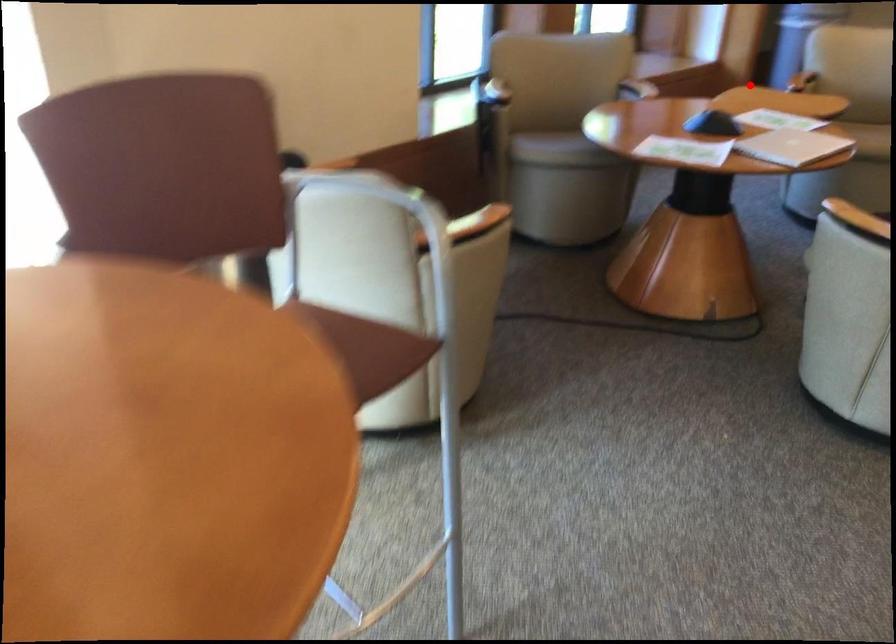
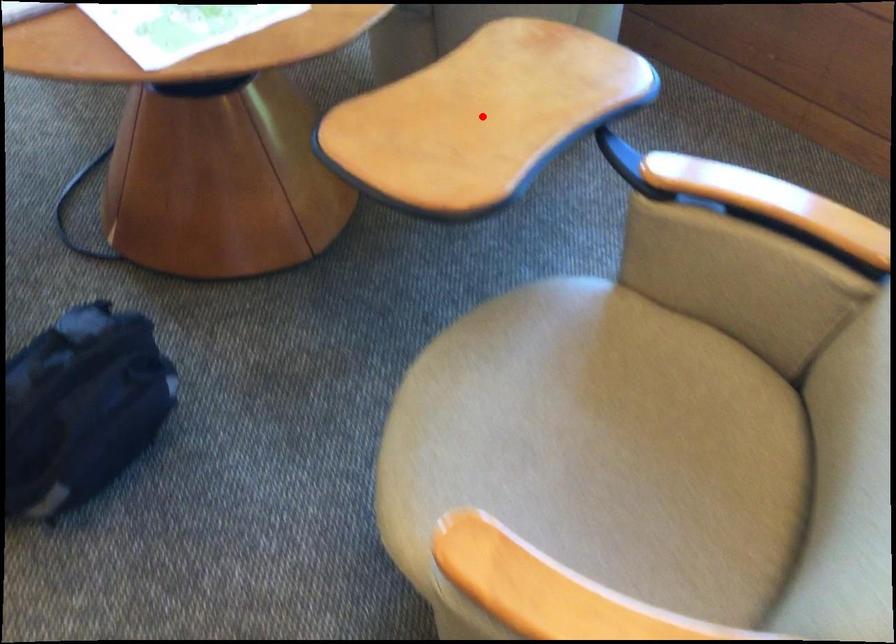
I am providing you with two images of the same scene from different viewpoints. A red point is marked on the first image and another point is marked on the second image. Does the point marked in image1 correspond to the same location as the one in image2?

Yes